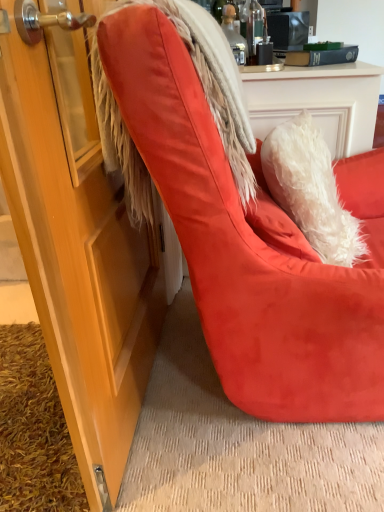
Question: From a real-world perspective, relative to fuzzy white fur coat at upper right, is suede orange chair at center vertically above or below?

Choices:
 (A) below
 (B) above

Answer: (A)

Question: Choose the correct answer: Is suede orange chair at center inside fuzzy white fur coat at upper right or outside it?

Choices:
 (A) inside
 (B) outside

Answer: (B)

Question: Considering the positions of suede orange chair at center and fuzzy white fur coat at upper right in the image, is suede orange chair at center wider or thinner than fuzzy white fur coat at upper right?

Choices:
 (A) thin
 (B) wide

Answer: (B)

Question: From a real-world perspective, is fuzzy white fur coat at upper right above or below suede orange chair at center?

Choices:
 (A) above
 (B) below

Answer: (A)

Question: From the image's perspective, is fuzzy white fur coat at upper right located above or below suede orange chair at center?

Choices:
 (A) above
 (B) below

Answer: (A)

Question: Based on their sizes in the image, would you say fuzzy white fur coat at upper right is bigger or smaller than suede orange chair at center?

Choices:
 (A) small
 (B) big

Answer: (A)

Question: Does point (253, 182) appear closer or farther from the camera than point (380, 294)?

Choices:
 (A) farther
 (B) closer

Answer: (A)